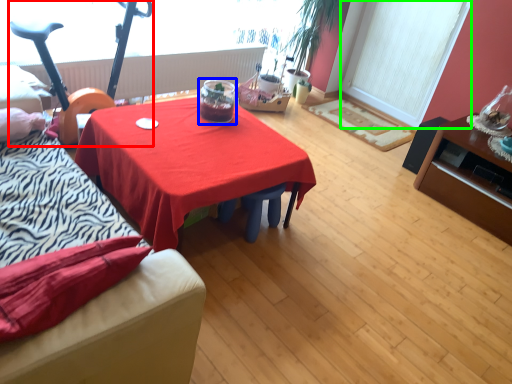
Question: Based on their relative distances, which object is farther from baby carriage (highlighted by a red box)? Choose from glass jar (highlighted by a blue box) and window screen (highlighted by a green box).

Choices:
 (A) glass jar
 (B) window screen

Answer: (B)